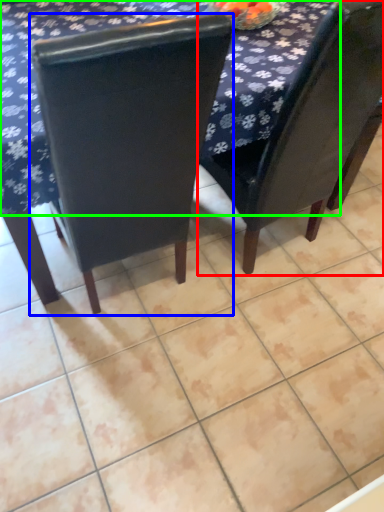
Question: Which is farther away from chair (highlighted by a red box)? chair (highlighted by a blue box) or tablecloth (highlighted by a green box)?

Choices:
 (A) chair
 (B) tablecloth

Answer: (A)